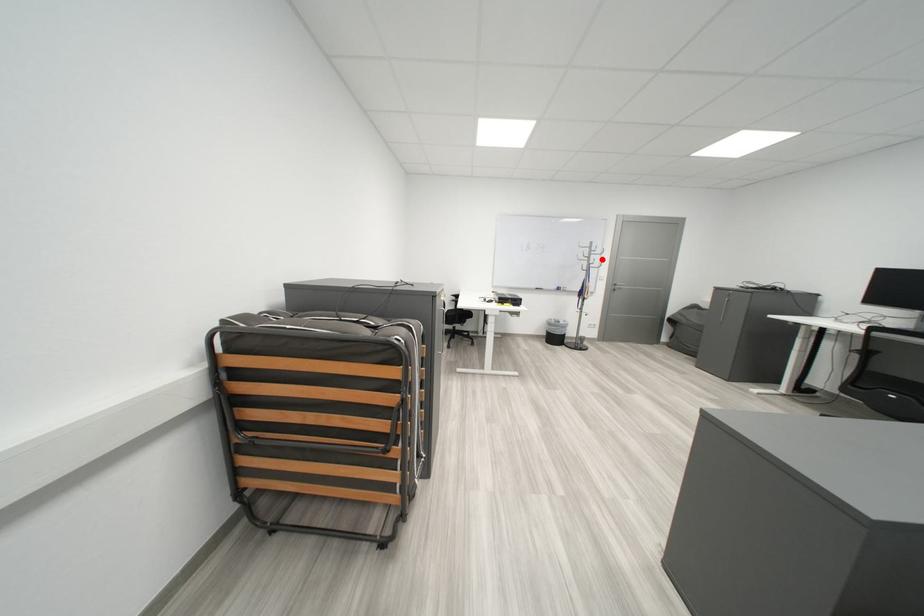
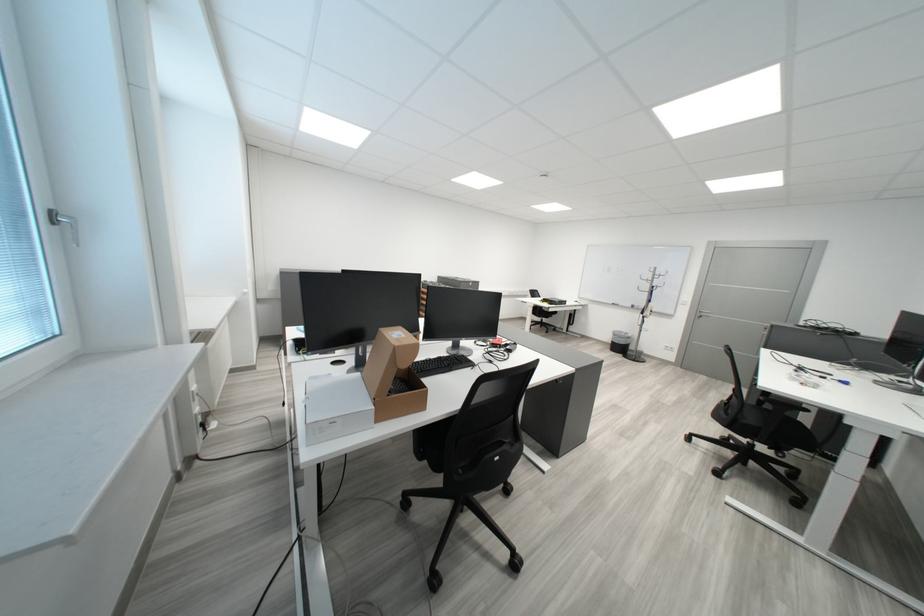
Question: I am providing you with two images of the same scene from different viewpoints. In image1, a red point is highlighted. Considering the same 3D point in image2, which of the following is correct?

Choices:
 (A) It is closer
 (B) It is farther

Answer: (A)